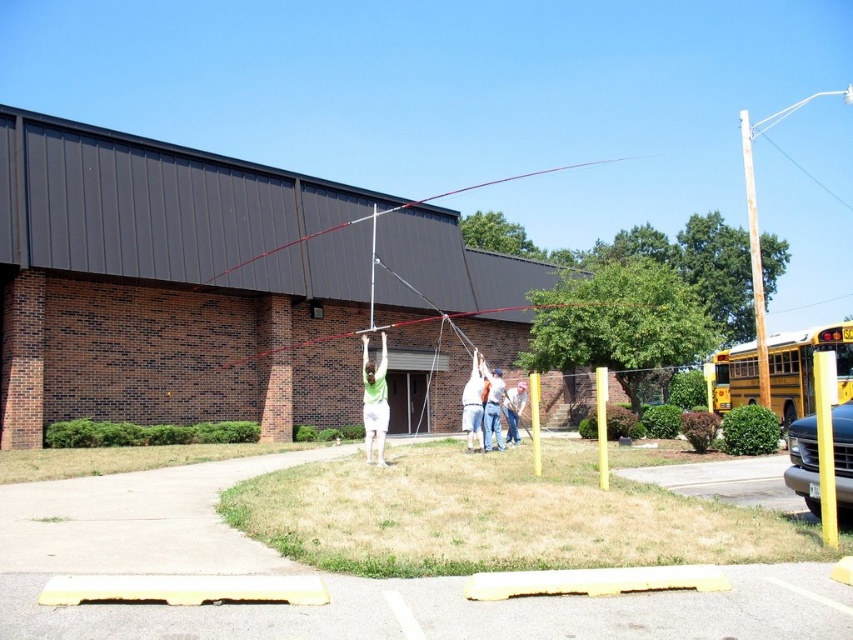
You are a maintenance worker needing to secure a new cable between the brown wooden pole at right and the yellow wood post at center. Based on the scene, which object should you attach the higher end of the cable?

The brown wooden pole at right is above the yellow wood post at center, so you should attach the higher end of the cable to the brown wooden pole at right.

You are a construction worker who needs to place a new tool box that is 1 meter in length between the brown wooden pole at right and the yellow wood post at center. Can you fit the tool box between them without moving either pole?

The distance between the brown wooden pole at right and the yellow wood post at center is 28.34 meters, which is much larger than the tool box length of 1 meter. Therefore, the tool box can easily be placed between them.